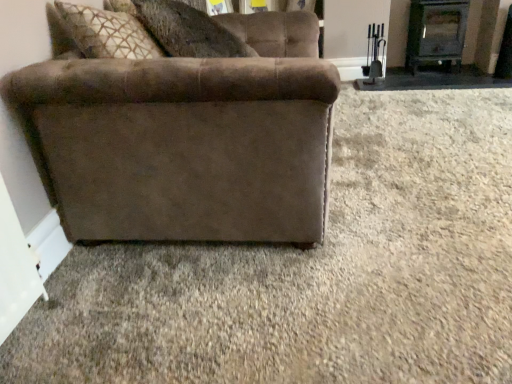
Question: Can you confirm if suede-like brown pillow at upper center is positioned to the right of suede brown couch at left?

Choices:
 (A) no
 (B) yes

Answer: (A)

Question: Is suede-like brown pillow at upper center positioned in front of suede brown couch at left?

Choices:
 (A) no
 (B) yes

Answer: (A)

Question: Does suede-like brown pillow at upper center have a greater width compared to suede brown couch at left?

Choices:
 (A) yes
 (B) no

Answer: (B)

Question: Is suede-like brown pillow at upper center facing towards suede brown couch at left?

Choices:
 (A) no
 (B) yes

Answer: (B)

Question: Is suede brown couch at left at the back of suede-like brown pillow at upper center?

Choices:
 (A) no
 (B) yes

Answer: (B)

Question: Is suede-like brown pillow at upper center thinner than suede brown couch at left?

Choices:
 (A) yes
 (B) no

Answer: (A)

Question: Does suede brown couch at left touch black metal fireplace at upper right?

Choices:
 (A) yes
 (B) no

Answer: (B)

Question: Would you say black metal fireplace at upper right is part of suede brown couch at left's contents?

Choices:
 (A) yes
 (B) no

Answer: (B)

Question: Could you tell me if suede brown couch at left is turned towards black metal fireplace at upper right?

Choices:
 (A) yes
 (B) no

Answer: (B)

Question: Considering the relative sizes of suede brown couch at left and black metal fireplace at upper right in the image provided, is suede brown couch at left thinner than black metal fireplace at upper right?

Choices:
 (A) yes
 (B) no

Answer: (B)

Question: Is suede brown couch at left positioned beyond the bounds of black metal fireplace at upper right?

Choices:
 (A) yes
 (B) no

Answer: (A)

Question: From the image's perspective, is suede brown couch at left above black metal fireplace at upper right?

Choices:
 (A) yes
 (B) no

Answer: (B)

Question: Can you confirm if suede brown couch at left is shorter than suede-like brown pillow at upper center?

Choices:
 (A) yes
 (B) no

Answer: (B)